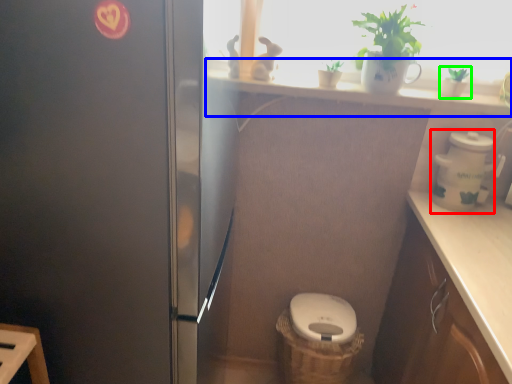
Question: Estimate the real-world distances between objects in this image. Which object is closer to appliance (highlighted by a red box), window sill (highlighted by a blue box) or houseplant (highlighted by a green box)?

Choices:
 (A) window sill
 (B) houseplant

Answer: (B)